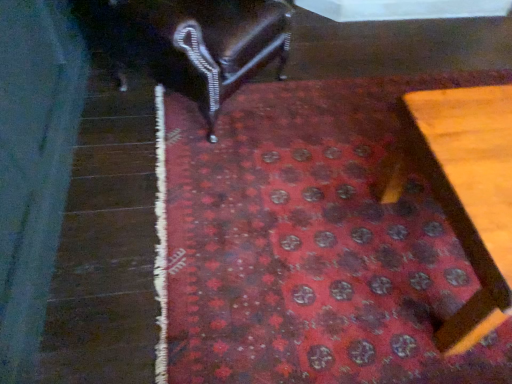
You are a GUI agent. You are given a task and a screenshot of the screen. Output one action in this format:
    pyautogui.click(x=<x>, y=<y>)
    Task: Click on the free location to the right of shiny dark wood chair at upper left, arranged as the 1th furniture when viewed from the top
    Image resolution: width=512 pixels, height=384 pixels.
    Given the screenshot: What is the action you would take?
    pyautogui.click(x=323, y=104)